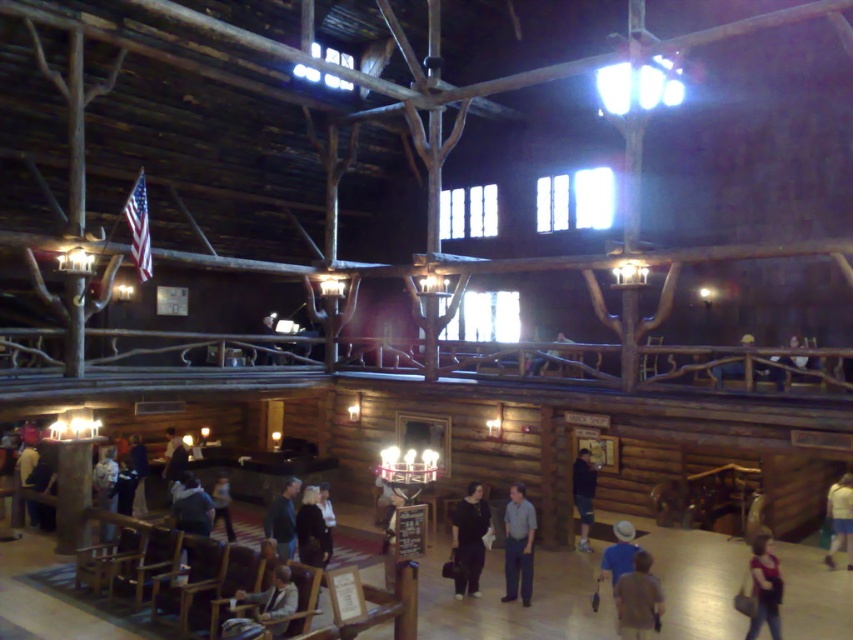
Question: Can you confirm if dark gray sweater at center is positioned below light blue shirt at center?

Choices:
 (A) no
 (B) yes

Answer: (A)

Question: Which of the following is the farthest from the observer?

Choices:
 (A) (258, 620)
 (B) (576, 483)
 (C) (753, 589)
 (D) (830, 548)

Answer: (B)

Question: Which of the following is the closest to the observer?

Choices:
 (A) light brown wooden chair at lower left
 (B) light blue shorts at lower right

Answer: (A)

Question: Which object appears closest to the camera in this image?

Choices:
 (A) dark green sweater at center
 (B) matte red shirt at lower right

Answer: (B)

Question: From the image, what is the correct spatial relationship of dark gray sweater at center in relation to dark blue jeans at center?

Choices:
 (A) above
 (B) below

Answer: (B)

Question: Is the position of dark blue jeans at center less distant than that of dark brown leather jacket at center?

Choices:
 (A) yes
 (B) no

Answer: (B)